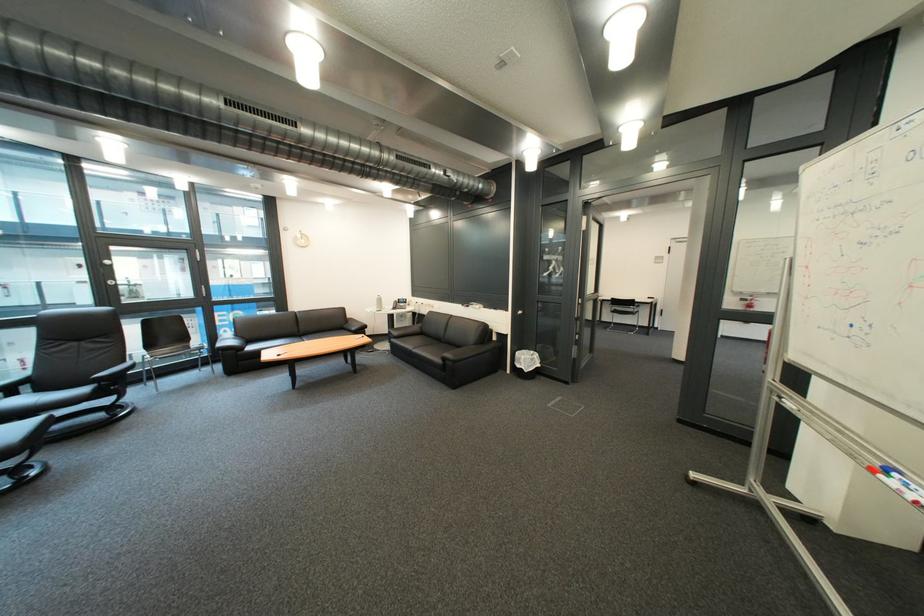
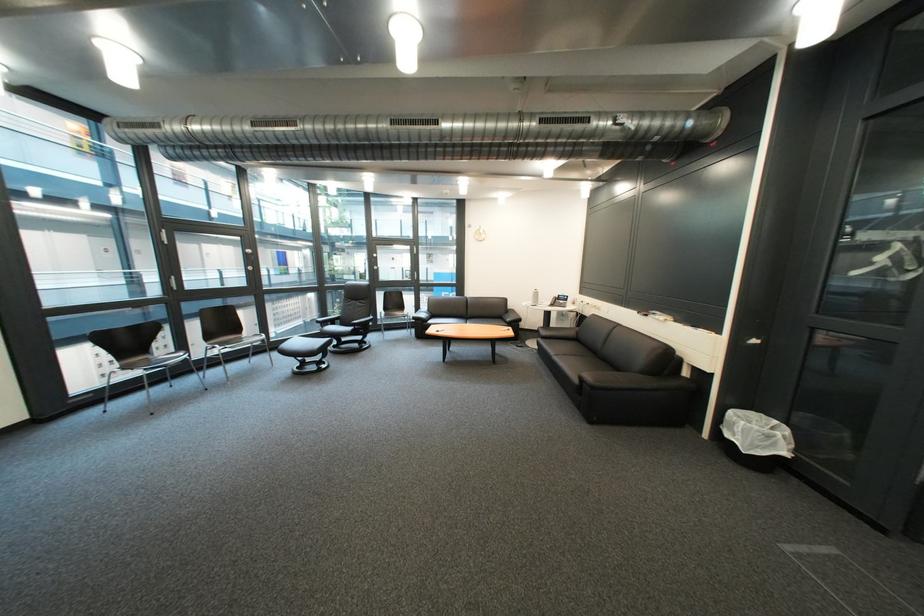
The point at (507, 339) is marked in the first image. Where is the corresponding point in the second image?

(699, 375)